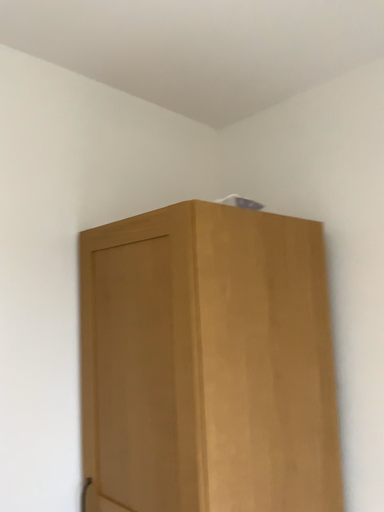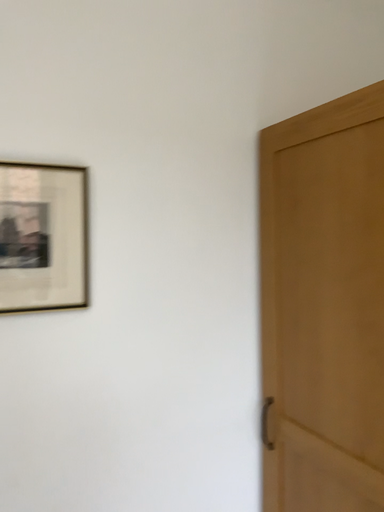
Question: Which way did the camera rotate in the video?

Choices:
 (A) rotated left
 (B) rotated right

Answer: (A)